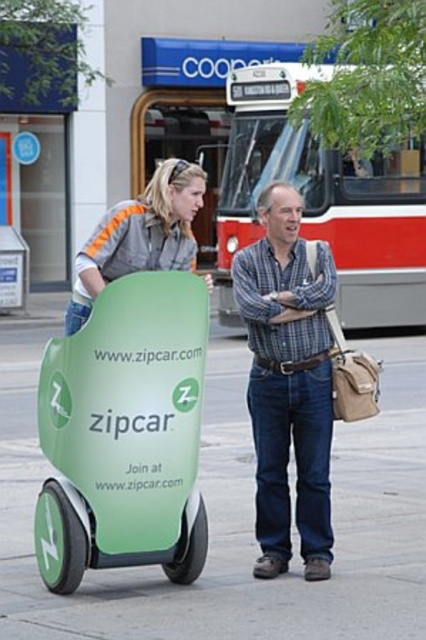
You are a delivery robot that is 1.5 meters wide. You are positioned at the green rubber hoverboard at center and need to move to the green matte zipcar at lower left. Can you fit through the space between them without moving either object?

The distance between the green rubber hoverboard at center and the green matte zipcar at lower left is 1.51 meters. Since the robot is 1.5 meters wide, it can fit through the space as there is enough clearance.

You are a delivery person who needs to choose between a green rubber hoverboard at center and a green matte zipcar at lower left to deliver packages in the city. Which vehicle would allow you to carry more items at once?

The green rubber hoverboard at center is bigger than the green matte zipcar at lower left, so it can carry more items at once.

You are a pedestrian standing on the sidewalk and see the green rubber hoverboard at center and the green matte zipcar at lower left. Which object is nearer to you?

The green rubber hoverboard at center is closer to the viewer than the green matte zipcar at lower left.